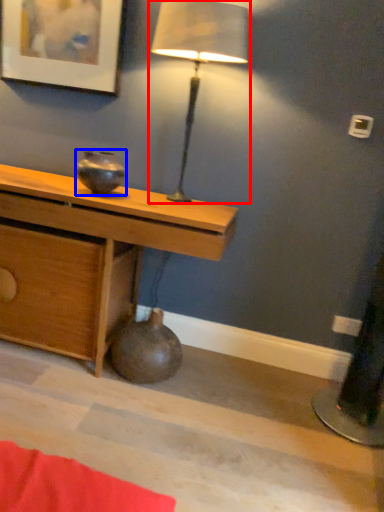
Question: Which object appears farthest to the camera in this image, lamp (highlighted by a red box) or vase (highlighted by a blue box)?

Choices:
 (A) lamp
 (B) vase

Answer: (B)